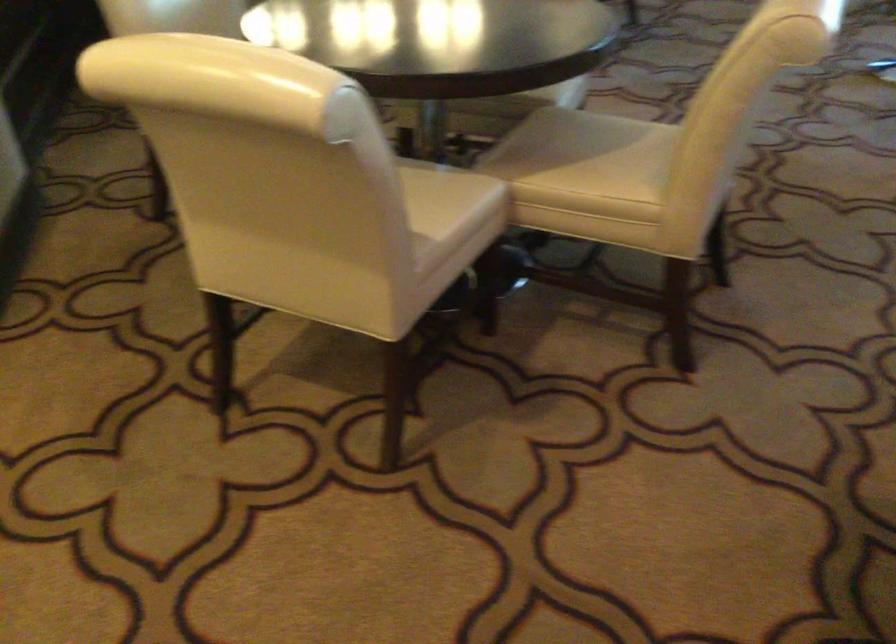
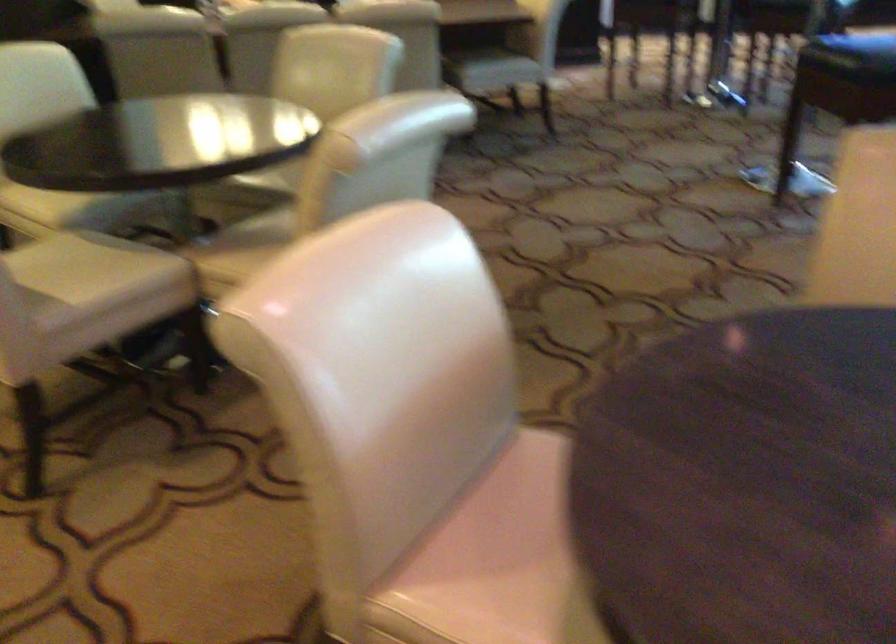
Where in the second image is the point corresponding to (x=560, y=146) from the first image?

(259, 234)